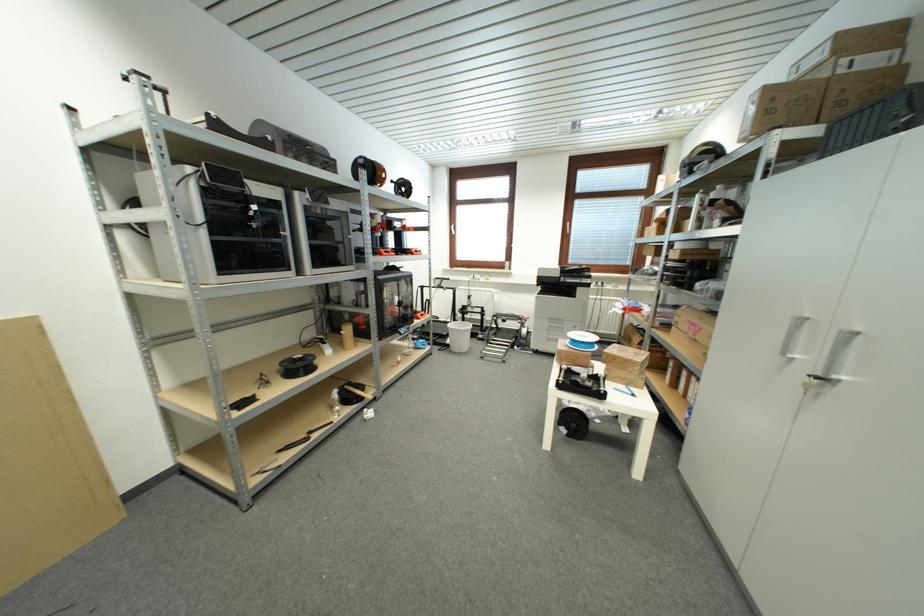
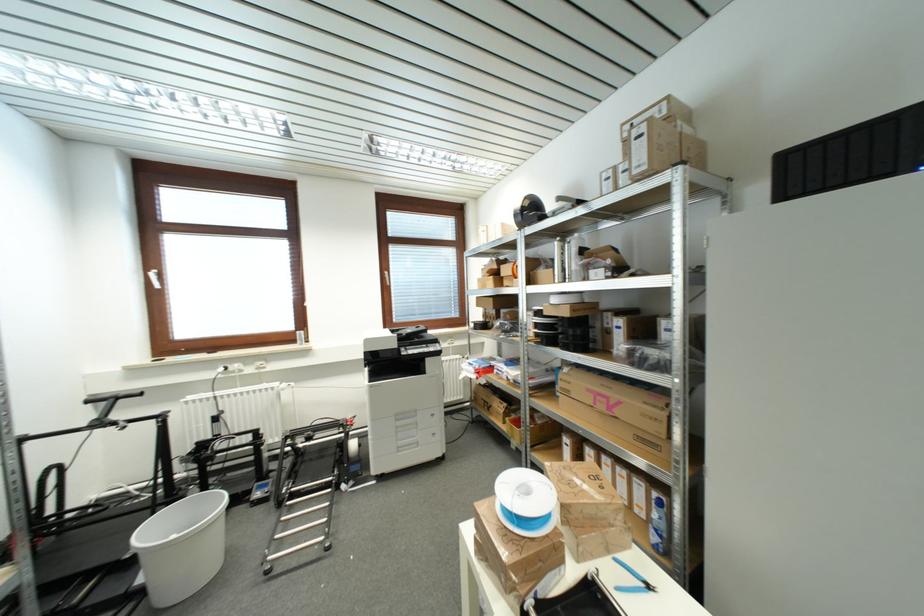
Find the pixel in the second image that matches point (555, 326) in the first image.

(404, 426)